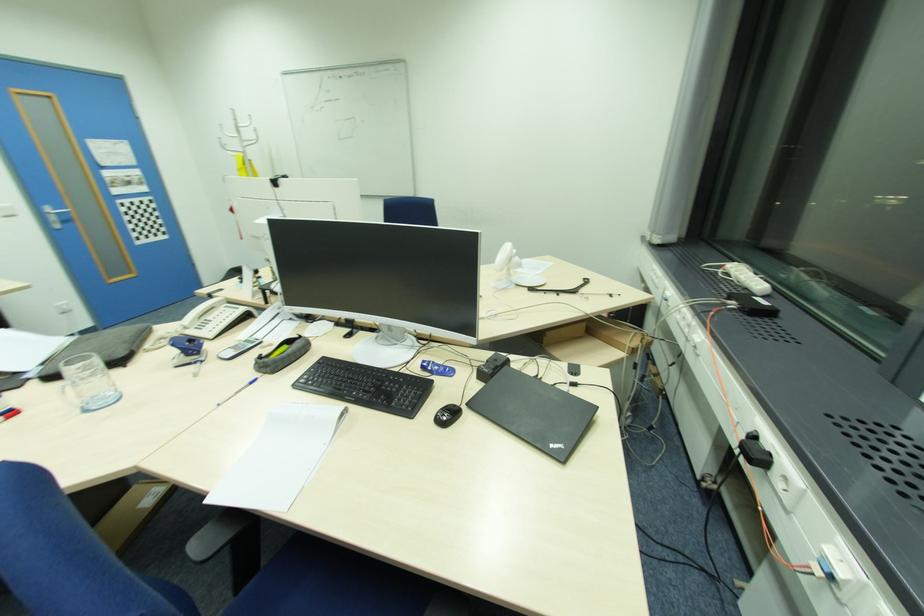
Locate an element on the screen. The width and height of the screenshot is (924, 616). silver door handle is located at coordinates (55, 211).